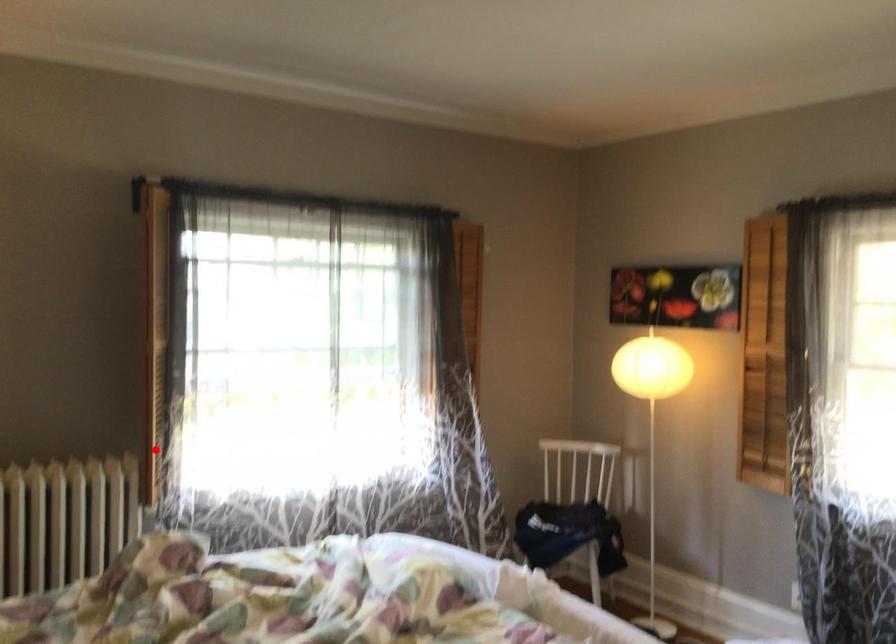
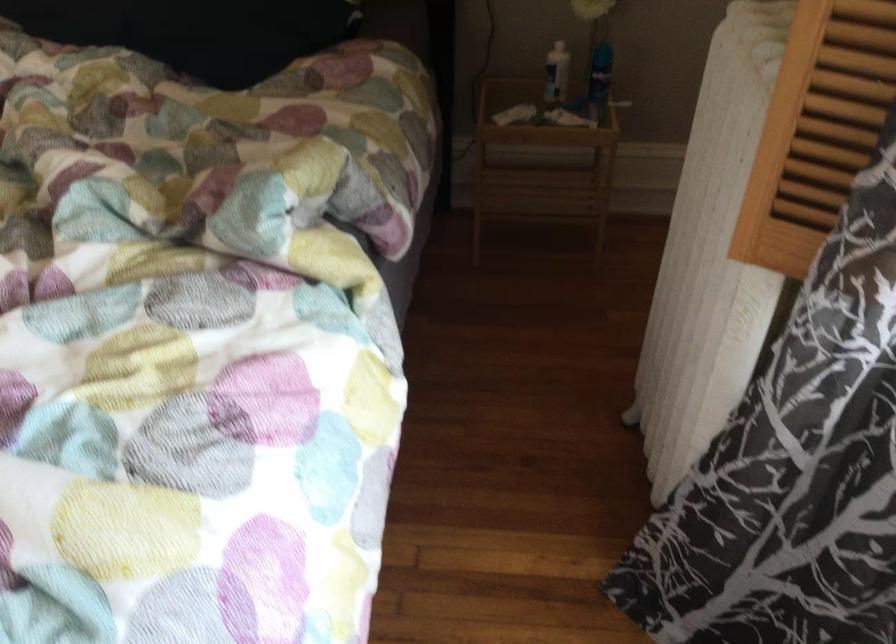
In the second image, find the point that corresponds to the highlighted location in the first image.

(815, 129)